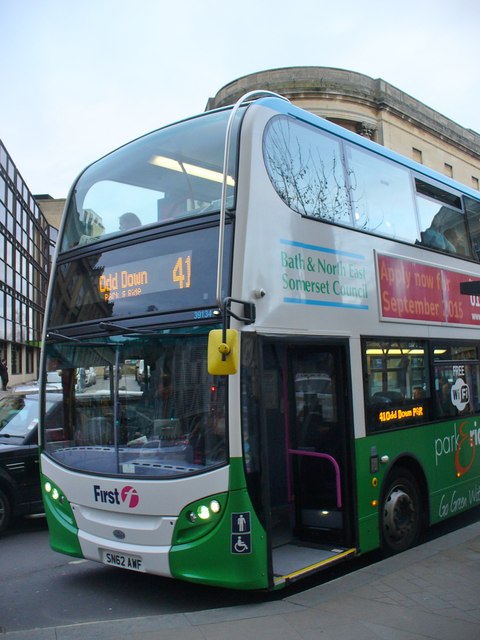
Image resolution: width=480 pixels, height=640 pixels. Identify the location of disability lift. (297, 550).